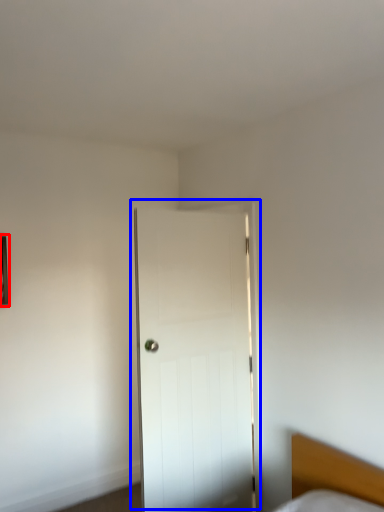
Question: Among these objects, which one is nearest to the camera, picture frame (highlighted by a red box) or door (highlighted by a blue box)?

Choices:
 (A) picture frame
 (B) door

Answer: (B)